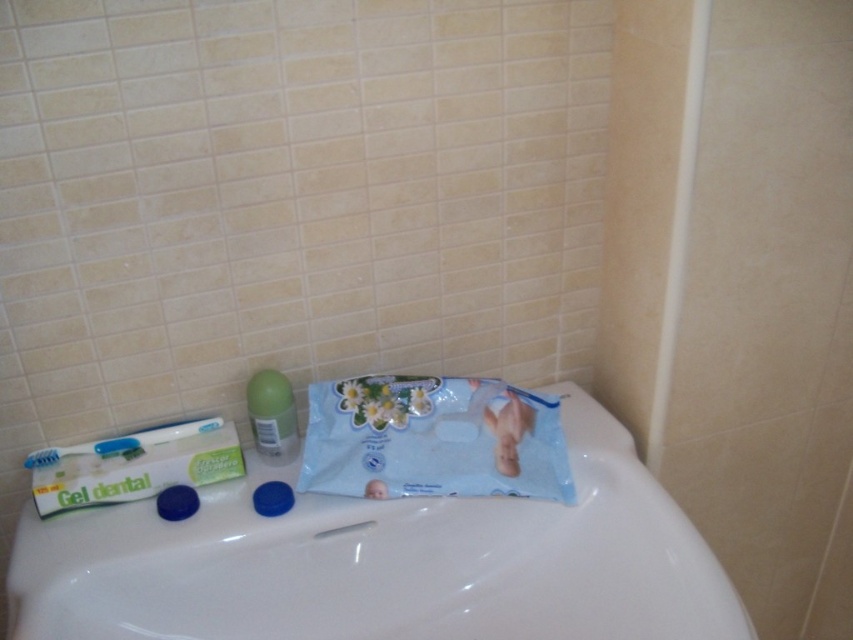
Question: Which object is positioned closest to the white matte toothpaste at lower left?

Choices:
 (A) white glossy sink at center
 (B) green matte deodorant at center

Answer: (B)

Question: Which object is closer to the camera taking this photo?

Choices:
 (A) white glossy sink at center
 (B) blue plastic toothbrush at left

Answer: (A)

Question: Does green matte deodorant at center appear over blue plastic toothbrush at left?

Choices:
 (A) no
 (B) yes

Answer: (B)

Question: Considering the relative positions of green matte deodorant at center and blue plastic toothbrush at left in the image provided, where is green matte deodorant at center located with respect to blue plastic toothbrush at left?

Choices:
 (A) right
 (B) left

Answer: (A)

Question: Observing the image, what is the correct spatial positioning of green matte deodorant at center in reference to blue plastic toothbrush at left?

Choices:
 (A) above
 (B) below

Answer: (A)

Question: Which of the following is the closest to the observer?

Choices:
 (A) (36, 461)
 (B) (74, 474)

Answer: (B)